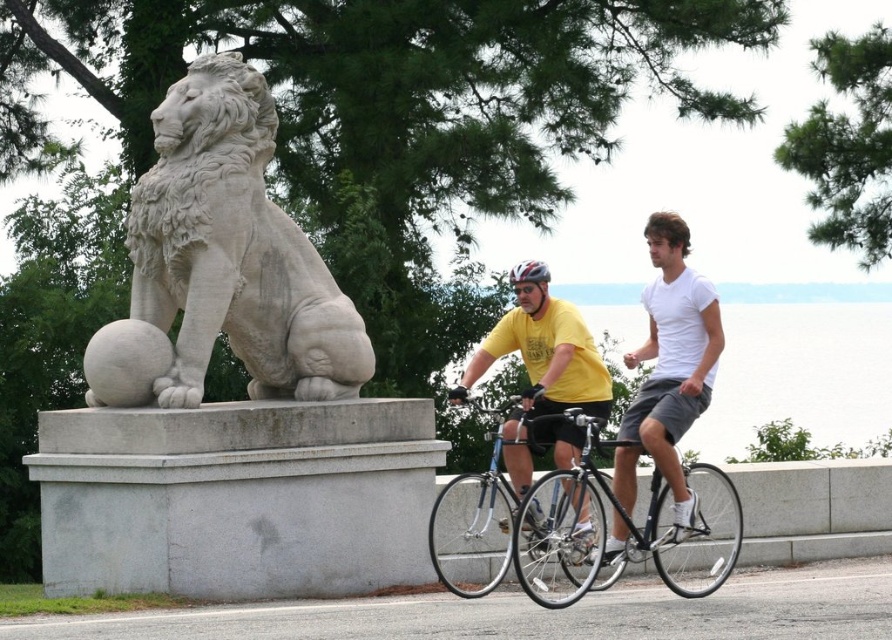
Which is above, white stone lion at left or shiny blue frame at center?

white stone lion at left

Does point (238, 64) come behind point (476, 513)?

Yes, point (238, 64) is behind point (476, 513).

The width and height of the screenshot is (892, 640). What are the coordinates of `white stone lion at left` in the screenshot? It's located at (233, 250).

Between white stone lion at left and white cotton shirt at center, which one appears on the left side from the viewer's perspective?

white stone lion at left

Can you confirm if white stone lion at left is bigger than white cotton shirt at center?

Correct, white stone lion at left is larger in size than white cotton shirt at center.

Measure the distance between white stone lion at left and camera.

They are 45.79 meters apart.

Identify the location of white stone lion at left. (233, 250).

Between white cotton shirt at center and matte black bicycle helmet at center, which one has more height?

Standing taller between the two is white cotton shirt at center.

Which is behind, point (675, 440) or point (524, 268)?

Positioned behind is point (524, 268).

You are a GUI agent. You are given a task and a screenshot of the screen. Output one action in this format:
    pyautogui.click(x=<x>, y=<y>)
    Task: Click on the white cotton shirt at center
    Image resolution: width=892 pixels, height=640 pixels.
    Given the screenshot: What is the action you would take?
    pyautogui.click(x=673, y=356)